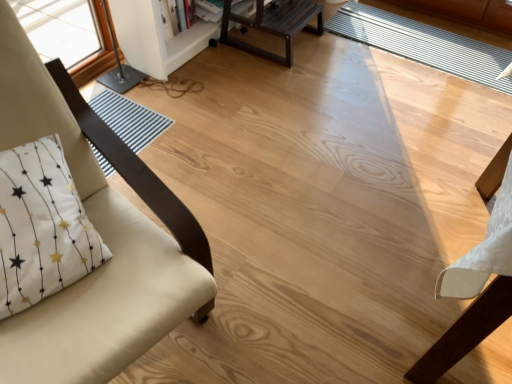
Where is `vacant space behind beige fabric chair at left`? The height and width of the screenshot is (384, 512). vacant space behind beige fabric chair at left is located at coordinates (202, 158).